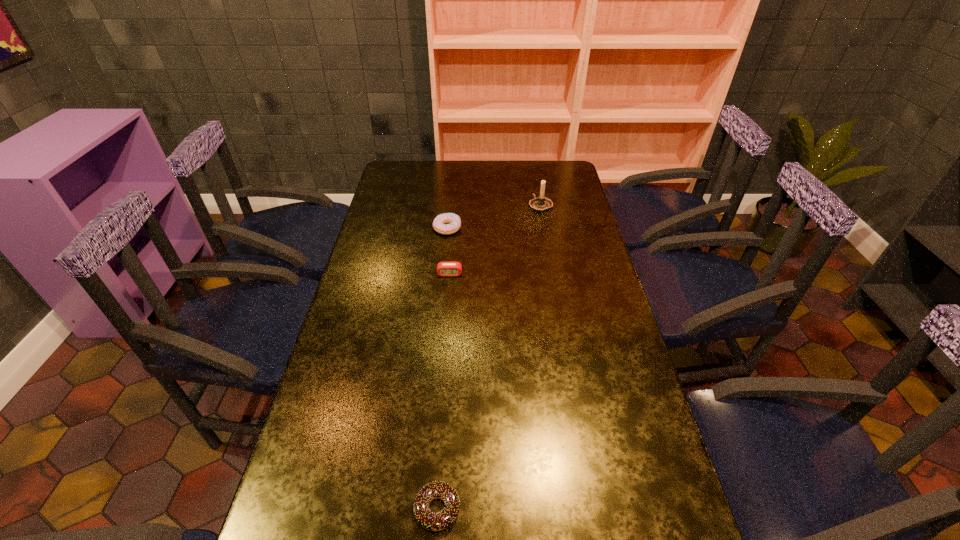
This screenshot has height=540, width=960. Identify the location of free space between the farther doughnut and the farthest object. click(x=494, y=217).

I want to click on free space between the candle holder and the nearer doughnut, so click(489, 357).

Find the location of a particular element. The height and width of the screenshot is (540, 960). free point between the nearest object and the farthest object is located at coordinates (489, 357).

Where is `vacant space that is in between the farthest object and the shorter doughnut`? vacant space that is in between the farthest object and the shorter doughnut is located at coordinates point(489,357).

Locate an element on the screen. The height and width of the screenshot is (540, 960). free spot between the third nearest object and the farthest object is located at coordinates (494, 217).

Identify the location of vacant space that's between the alarm clock and the farther doughnut. (448, 251).

Identify the location of object that is the third closest to the taller doughnut. The width and height of the screenshot is (960, 540). (431, 521).

At what (x,y) coordinates should I click in order to perform the action: click on object that ranks as the second closest to the nearer doughnut. Please return your answer as a coordinate pair (x, y). Looking at the image, I should click on (439, 222).

Locate an element on the screen. The width and height of the screenshot is (960, 540). free location that satisfies the following two spatial constraints: 1. on the back side of the shorter doughnut; 2. on the right side of the candle holder is located at coordinates (458, 205).

Where is `free spot that satisfies the following two spatial constraints: 1. on the back side of the nearer doughnut; 2. on the left side of the farthest object`? The image size is (960, 540). free spot that satisfies the following two spatial constraints: 1. on the back side of the nearer doughnut; 2. on the left side of the farthest object is located at coordinates (458, 205).